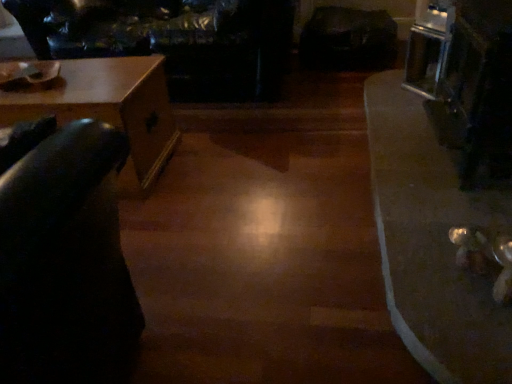
Question: Is wooden table at left, the first table from the left, surrounded by shiny metallic table at lower right, the 1th table from the right?

Choices:
 (A) yes
 (B) no

Answer: (B)

Question: Is the surface of shiny metallic table at lower right, the 1th table from the right, in direct contact with wooden table at left, which is the second table from right to left?

Choices:
 (A) no
 (B) yes

Answer: (A)

Question: Is shiny metallic table at lower right, placed as the second table when sorted from left to right, positioned with its back to wooden table at left, the first table from the left?

Choices:
 (A) no
 (B) yes

Answer: (A)

Question: Can you confirm if shiny metallic table at lower right, the 1th table from the right, is wider than wooden table at left, the first table from the left?

Choices:
 (A) no
 (B) yes

Answer: (A)

Question: Is shiny metallic table at lower right, the 1th table from the right, facing towards wooden table at left, the first table from the left?

Choices:
 (A) no
 (B) yes

Answer: (B)

Question: Are shiny metallic table at lower right, placed as the second table when sorted from left to right, and wooden table at left, the first table from the left, located far from each other?

Choices:
 (A) no
 (B) yes

Answer: (B)

Question: Would you consider wooden table at left, which is the second table from right to left, to be distant from leather couch at upper left?

Choices:
 (A) no
 (B) yes

Answer: (A)

Question: From a real-world perspective, is wooden table at left, the first table from the left, below leather couch at upper left?

Choices:
 (A) yes
 (B) no

Answer: (A)

Question: Can you confirm if wooden table at left, the first table from the left, is positioned to the right of leather couch at upper left?

Choices:
 (A) yes
 (B) no

Answer: (B)

Question: From the image's perspective, is wooden table at left, which is the second table from right to left, beneath leather couch at upper left?

Choices:
 (A) no
 (B) yes

Answer: (B)

Question: Does wooden table at left, which is the second table from right to left, have a lesser width compared to leather couch at upper left?

Choices:
 (A) yes
 (B) no

Answer: (A)

Question: Can you confirm if wooden table at left, the first table from the left, is taller than leather couch at upper left?

Choices:
 (A) yes
 (B) no

Answer: (B)

Question: Is the position of wooden table at left, the first table from the left, less distant than that of shiny metallic table at lower right, placed as the second table when sorted from left to right?

Choices:
 (A) no
 (B) yes

Answer: (A)